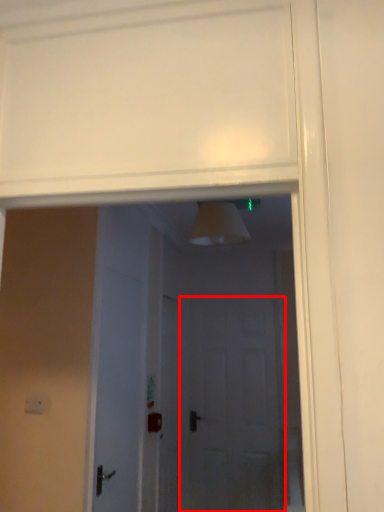
Question: From the image's perspective, what is the correct spatial relationship of screen door (annotated by the red box) in relation to door?

Choices:
 (A) below
 (B) above

Answer: (A)